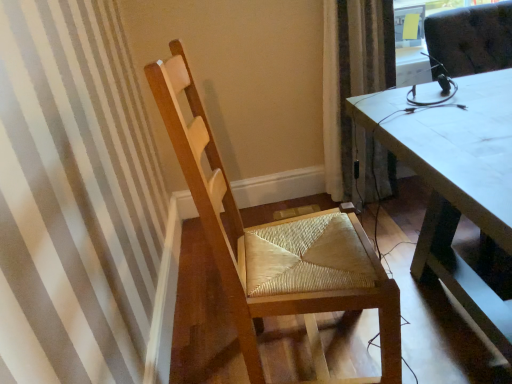
This screenshot has width=512, height=384. Describe the element at coordinates (353, 87) in the screenshot. I see `brown textured curtain at upper right` at that location.

In order to face brown textured curtain at upper right, should I rotate leftwards or rightwards?

A 14.737 degree turn to the right will do.

At what (x,y) coordinates should I click in order to perform the action: click on brown textured curtain at upper right. Please return your answer as a coordinate pair (x, y). The width and height of the screenshot is (512, 384). Looking at the image, I should click on (353, 87).

This screenshot has width=512, height=384. I want to click on natural wood chair at left, so click(x=277, y=245).

The width and height of the screenshot is (512, 384). What do you see at coordinates (277, 245) in the screenshot? I see `natural wood chair at left` at bounding box center [277, 245].

Find the location of `brown textured curtain at upper right`. brown textured curtain at upper right is located at coordinates (353, 87).

From the picture: Is natural wood chair at left to the left or to the right of brown textured curtain at upper right in the image?

In the image, natural wood chair at left appears on the left side of brown textured curtain at upper right.

Is natural wood chair at left positioned in front of brown textured curtain at upper right?

Yes, natural wood chair at left is closer to the camera.

Is point (370, 284) more distant than point (345, 170)?

No, it is in front of (345, 170).

From the image's perspective, is natural wood chair at left located above brown textured curtain at upper right?

No, from the image's perspective, natural wood chair at left is not on top of brown textured curtain at upper right.

From a real-world perspective, which is physically below, natural wood chair at left or brown textured curtain at upper right?

From a 3D spatial view, brown textured curtain at upper right is below.

Which of these two, natural wood chair at left or brown textured curtain at upper right, is thinner?

brown textured curtain at upper right is thinner.

From their relative heights in the image, would you say natural wood chair at left is taller or shorter than brown textured curtain at upper right?

In the image, natural wood chair at left appears to be taller than brown textured curtain at upper right.

Considering the sizes of objects natural wood chair at left and brown textured curtain at upper right in the image provided, who is bigger, natural wood chair at left or brown textured curtain at upper right?

Bigger between the two is natural wood chair at left.

Would you say brown textured curtain at upper right is part of natural wood chair at left's contents?

No, brown textured curtain at upper right is not a part of natural wood chair at left.

Are natural wood chair at left and brown textured curtain at upper right making contact?

natural wood chair at left and brown textured curtain at upper right are clearly separated.

Is natural wood chair at left facing away from brown textured curtain at upper right?

No, natural wood chair at left is not facing away from brown textured curtain at upper right.

What's the angular difference between natural wood chair at left and brown textured curtain at upper right's facing directions?

natural wood chair at left and brown textured curtain at upper right are facing 78.2 degrees away from each other.

Find the location of a particular element. curtain on the right side of natural wood chair at left is located at coordinates click(353, 87).

Between brown textured curtain at upper right and natural wood chair at left, which one appears on the left side from the viewer's perspective?

natural wood chair at left.

Is brown textured curtain at upper right positioned before natural wood chair at left?

That is False.

Between point (349, 171) and point (260, 284), which one is positioned in front?

Positioned in front is point (260, 284).

From the image's perspective, who appears lower, brown textured curtain at upper right or natural wood chair at left?

natural wood chair at left.

From a real-world perspective, which is physically below, brown textured curtain at upper right or natural wood chair at left?

brown textured curtain at upper right.

Between brown textured curtain at upper right and natural wood chair at left, which one has smaller width?

Thinner between the two is brown textured curtain at upper right.

Based on the photo, can you confirm if brown textured curtain at upper right is shorter than natural wood chair at left?

Yes.

Consider the image. Considering the sizes of objects brown textured curtain at upper right and natural wood chair at left in the image provided, who is bigger, brown textured curtain at upper right or natural wood chair at left?

With larger size is natural wood chair at left.

Is brown textured curtain at upper right spatially inside natural wood chair at left, or outside of it?

brown textured curtain at upper right lies outside natural wood chair at left.

Is brown textured curtain at upper right not close to natural wood chair at left?

No, brown textured curtain at upper right is in close proximity to natural wood chair at left.

Is brown textured curtain at upper right aimed at natural wood chair at left?

A: No, brown textured curtain at upper right is not oriented towards natural wood chair at left.

How many degrees apart are the facing directions of brown textured curtain at upper right and natural wood chair at left?

There is a 78.2-degree angle between the facing directions of brown textured curtain at upper right and natural wood chair at left.

Locate an element on the screen. This screenshot has height=384, width=512. curtain located underneath the natural wood chair at left (from a real-world perspective) is located at coordinates click(353, 87).

Image resolution: width=512 pixels, height=384 pixels. Identify the location of curtain on the right of natural wood chair at left. (353, 87).

Identify the location of curtain above the natural wood chair at left (from the image's perspective). (x=353, y=87).